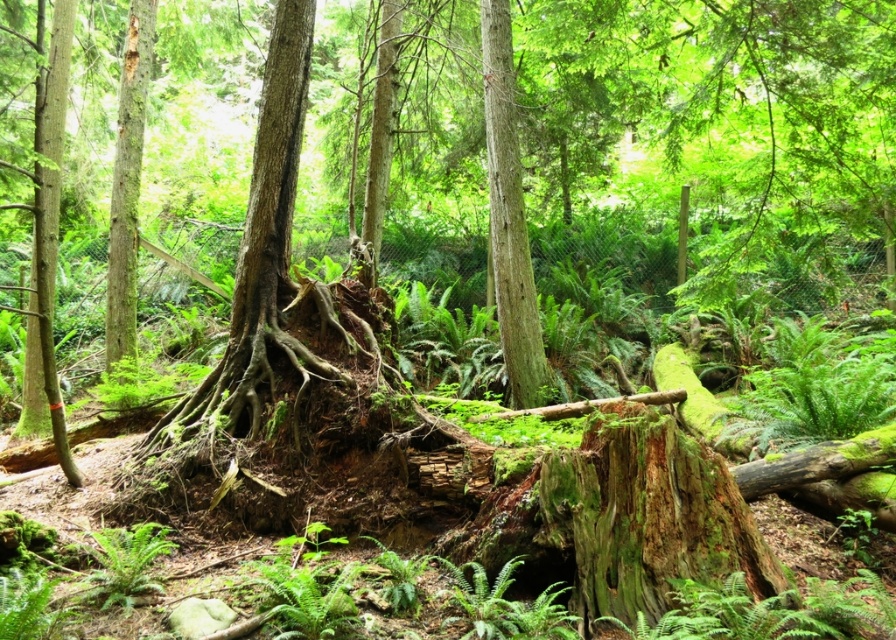
Question: Where is smooth brown tree trunk at left located in relation to green fuzzy fern at lower left in the image?

Choices:
 (A) left
 (B) right

Answer: (A)

Question: Does smooth brown tree trunk at center have a greater width compared to smooth brown tree trunk at left?

Choices:
 (A) yes
 (B) no

Answer: (A)

Question: Can you confirm if smooth brown tree trunk at center is bigger than smooth brown tree trunk at left?

Choices:
 (A) yes
 (B) no

Answer: (A)

Question: Which is farther from the green fuzzy fern at lower left?

Choices:
 (A) smooth brown tree trunk at left
 (B) smooth brown tree trunk at center

Answer: (B)

Question: Estimate the real-world distances between objects in this image. Which object is closer to the smooth brown tree trunk at left?

Choices:
 (A) green fuzzy fern at lower left
 (B) smooth brown tree trunk at center

Answer: (B)

Question: Which point is farther to the camera?

Choices:
 (A) green fuzzy fern at lower left
 (B) smooth brown tree trunk at center

Answer: (B)